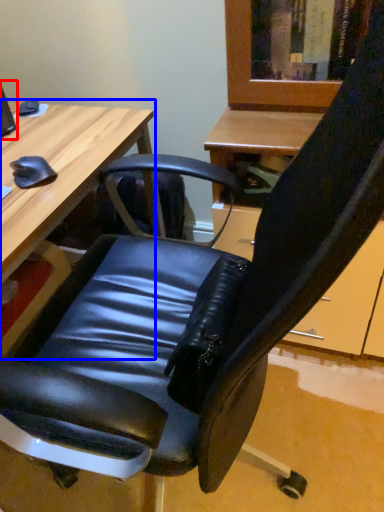
Question: Which of the following is the farthest to the observer, computer monitor (highlighted by a red box) or desk (highlighted by a blue box)?

Choices:
 (A) computer monitor
 (B) desk

Answer: (A)